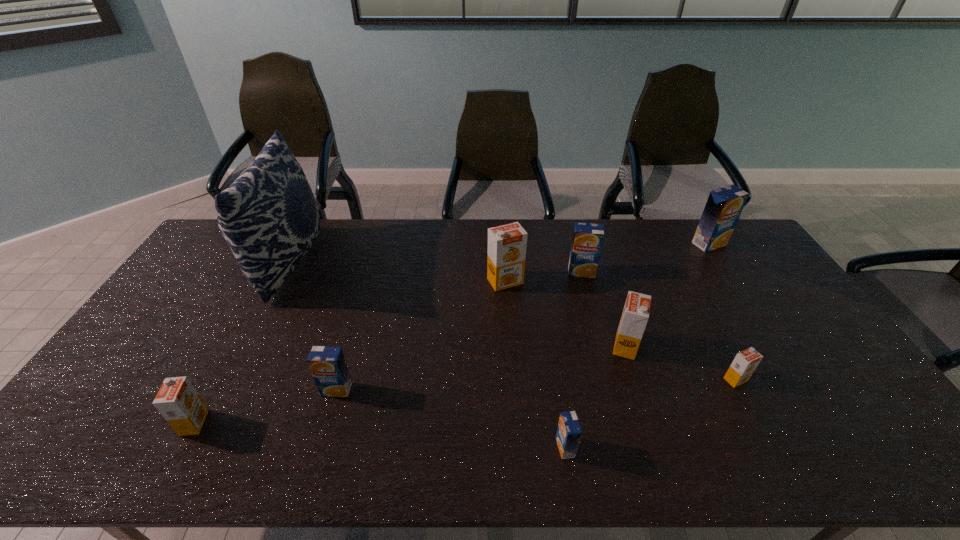
You are a GUI agent. You are given a task and a screenshot of the screen. Output one action in this format:
    pyautogui.click(x=<x>, y=<y>)
    Task: Click on the free space located on the front of the biggest orange orange juice
    The width and height of the screenshot is (960, 540).
    Given the screenshot: What is the action you would take?
    pyautogui.click(x=508, y=319)

Locate an element on the screen. The height and width of the screenshot is (540, 960). vacant space located 0.400m on the right of the second farthest blue orange_juice is located at coordinates [712, 272].

This screenshot has height=540, width=960. I want to click on free spot located 0.260m on the back of the third smallest orange orange juice, so click(603, 275).

Where is `vacant region located 0.110m on the front of the third farthest blue orange_juice`? The width and height of the screenshot is (960, 540). vacant region located 0.110m on the front of the third farthest blue orange_juice is located at coordinates (323, 437).

In order to click on free spot located on the front of the second smallest orange orange juice in this screenshot , I will do `click(174, 461)`.

The height and width of the screenshot is (540, 960). Find the location of `free location located on the left of the smallest orange orange juice`. free location located on the left of the smallest orange orange juice is located at coordinates (588, 380).

The height and width of the screenshot is (540, 960). I want to click on free space located 0.230m on the left of the fifth object from right to left, so pos(458,448).

Where is `cushion that is at the far edge`? cushion that is at the far edge is located at coordinates (269, 217).

At what (x,y) coordinates should I click in order to perform the action: click on orange_juice that is at the far edge. Please return your answer as a coordinate pair (x, y). Looking at the image, I should click on (722, 210).

The image size is (960, 540). I want to click on object that is at the right edge, so click(x=722, y=210).